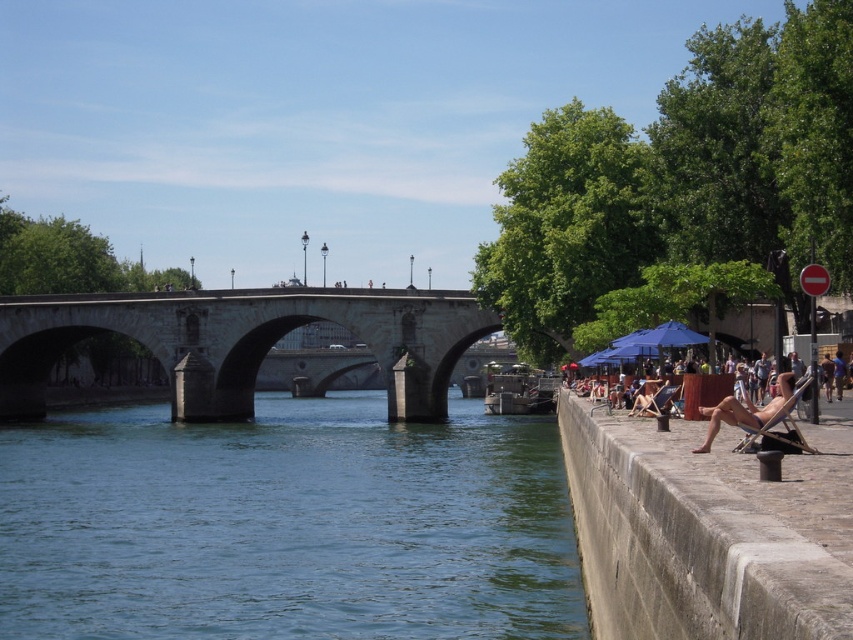
Question: Is green water at lower left to the left of stone bridge at center from the viewer's perspective?

Choices:
 (A) yes
 (B) no

Answer: (B)

Question: Which object is closer to the camera taking this photo?

Choices:
 (A) stone bridge at center
 (B) brown leather chair at right
 (C) tan skin person at right

Answer: (C)

Question: In this image, where is green water at lower left located relative to brown leather chair at right?

Choices:
 (A) left
 (B) right

Answer: (A)

Question: Which of the following is the farthest from the observer?

Choices:
 (A) coord(543,580)
 (B) coord(714,422)
 (C) coord(712,628)
 (D) coord(91,292)

Answer: (D)

Question: Can you confirm if concrete at right is positioned above tan skin person at right?

Choices:
 (A) yes
 (B) no

Answer: (B)

Question: Among these objects, which one is farthest from the camera?

Choices:
 (A) concrete at right
 (B) tan skin person at right
 (C) stone bridge at center
 (D) green water at lower left

Answer: (C)